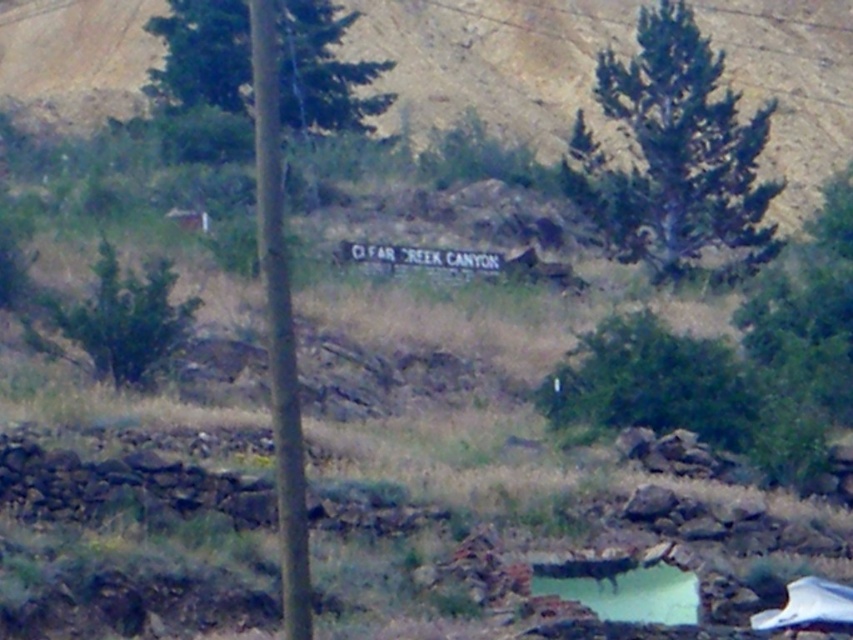
Question: Which point is closer to the camera?

Choices:
 (A) green wood pole at center
 (B) green textured tree at upper right

Answer: (A)

Question: Which point is farther to the camera?

Choices:
 (A) (294, 70)
 (B) (289, 368)
 (C) (573, 193)
 (D) (691, 624)

Answer: (A)

Question: Where is green textured tree at upper right located in relation to green reflective water at center in the image?

Choices:
 (A) below
 (B) above

Answer: (B)

Question: Does green grassy hillside at center appear over green wood pole at center?

Choices:
 (A) no
 (B) yes

Answer: (B)

Question: Can you confirm if green grassy hillside at center is positioned to the left of green leafy tree at upper center?

Choices:
 (A) yes
 (B) no

Answer: (B)

Question: Among these objects, which one is farthest from the camera?

Choices:
 (A) green leafy tree at upper center
 (B) green textured tree at upper right
 (C) green reflective water at center

Answer: (A)